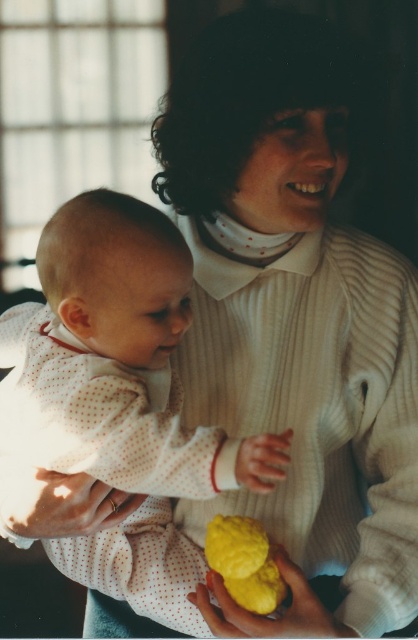
Can you confirm if white dotted fabric at center is positioned above yellow matte cookie at lower center?

Indeed, white dotted fabric at center is positioned over yellow matte cookie at lower center.

Does white dotted fabric at center have a greater width compared to yellow matte cookie at lower center?

Correct, the width of white dotted fabric at center exceeds that of yellow matte cookie at lower center.

Find the location of a particular element. The height and width of the screenshot is (640, 418). white dotted fabric at center is located at coordinates (116, 358).

At what (x,y) coordinates should I click in order to perform the action: click on white dotted fabric at center. Please return your answer as a coordinate pair (x, y). Looking at the image, I should click on (116, 358).